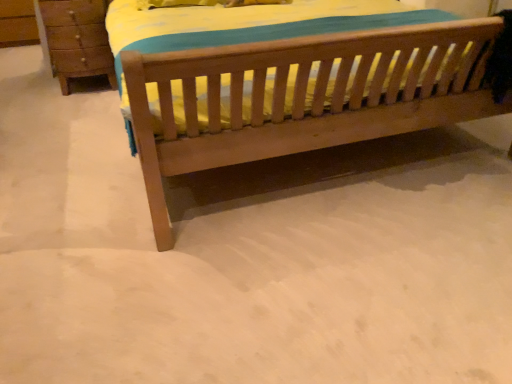
What do you see at coordinates (289, 83) in the screenshot? The height and width of the screenshot is (384, 512). I see `wooden bed at center` at bounding box center [289, 83].

Identify the location of wooden bed at center. (289, 83).

The width and height of the screenshot is (512, 384). Find the location of `wooden chest of drawers at left`. wooden chest of drawers at left is located at coordinates (77, 40).

What is the approximate height of wooden chest of drawers at left?

The height of wooden chest of drawers at left is 26.63 inches.

This screenshot has width=512, height=384. Describe the element at coordinates (77, 40) in the screenshot. I see `wooden chest of drawers at left` at that location.

Identify the location of wooden bed at center. (289, 83).

Consider the image. Which object is positioned more to the left, wooden chest of drawers at left or wooden bed at center?

wooden chest of drawers at left is more to the left.

Is wooden chest of drawers at left closer to the viewer compared to wooden bed at center?

No, it is behind wooden bed at center.

Does point (70, 62) appear closer or farther from the camera than point (189, 16)?

Point (70, 62) appears to be farther away from the viewer than point (189, 16).

From the image's perspective, is wooden chest of drawers at left located above or below wooden bed at center?

From the image's perspective, wooden chest of drawers at left appears above wooden bed at center.

From a real-world perspective, is wooden chest of drawers at left physically above wooden bed at center?

Indeed, from a real-world perspective, wooden chest of drawers at left stands above wooden bed at center.

Considering the relative sizes of wooden chest of drawers at left and wooden bed at center in the image provided, is wooden chest of drawers at left thinner than wooden bed at center?

Yes.

Which of these two, wooden chest of drawers at left or wooden bed at center, stands shorter?

wooden bed at center.

Between wooden chest of drawers at left and wooden bed at center, which one has smaller size?

With smaller size is wooden chest of drawers at left.

Is wooden chest of drawers at left positioned beyond the bounds of wooden bed at center?

Yes, wooden chest of drawers at left is located beyond the bounds of wooden bed at center.

Can you see wooden chest of drawers at left touching wooden bed at center?

They are not placed beside each other.

Is wooden chest of drawers at left facing towards wooden bed at center?

No, wooden chest of drawers at left does not turn towards wooden bed at center.

What's the angular difference between wooden chest of drawers at left and wooden bed at center's facing directions?

1.77 degrees separate the facing orientations of wooden chest of drawers at left and wooden bed at center.

Identify the location of bed directly beneath the wooden chest of drawers at left (from a real-world perspective). (289, 83).

Which is more to the left, wooden bed at center or wooden chest of drawers at left?

From the viewer's perspective, wooden chest of drawers at left appears more on the left side.

Which object is further away from the camera taking this photo, wooden bed at center or wooden chest of drawers at left?

→ wooden chest of drawers at left.

Which is in front, point (176, 43) or point (104, 14)?

Point (176, 43)

From the image's perspective, which object appears higher, wooden bed at center or wooden chest of drawers at left?

wooden chest of drawers at left appears higher in the image.

From a real-world perspective, is wooden bed at center below wooden chest of drawers at left?

Yes, from a real-world perspective, wooden bed at center is beneath wooden chest of drawers at left.

Between wooden bed at center and wooden chest of drawers at left, which one has smaller width?

Thinner between the two is wooden chest of drawers at left.

Does wooden bed at center have a lesser height compared to wooden chest of drawers at left?

Yes, wooden bed at center is shorter than wooden chest of drawers at left.

Looking at the image, does wooden bed at center seem bigger or smaller compared to wooden chest of drawers at left?

wooden bed at center is bigger than wooden chest of drawers at left.

Is wooden bed at center spatially inside wooden chest of drawers at left, or outside of it?

wooden bed at center is located beyond the bounds of wooden chest of drawers at left.

Is wooden bed at center far from wooden chest of drawers at left?

That's right, there is a large distance between wooden bed at center and wooden chest of drawers at left.

Could you tell me if wooden bed at center is turned towards wooden chest of drawers at left?

No, wooden bed at center is not aimed at wooden chest of drawers at left.

How different are the orientations of wooden bed at center and wooden chest of drawers at left in degrees?

1.77 degrees.

The height and width of the screenshot is (384, 512). Find the location of `bed below the wooden chest of drawers at left (from a real-world perspective)`. bed below the wooden chest of drawers at left (from a real-world perspective) is located at coordinates (289, 83).

What are the coordinates of `chest of drawers to the left of wooden bed at center` in the screenshot? It's located at (77, 40).

The width and height of the screenshot is (512, 384). What are the coordinates of `chest of drawers above the wooden bed at center (from the image's perspective)` in the screenshot? It's located at (77, 40).